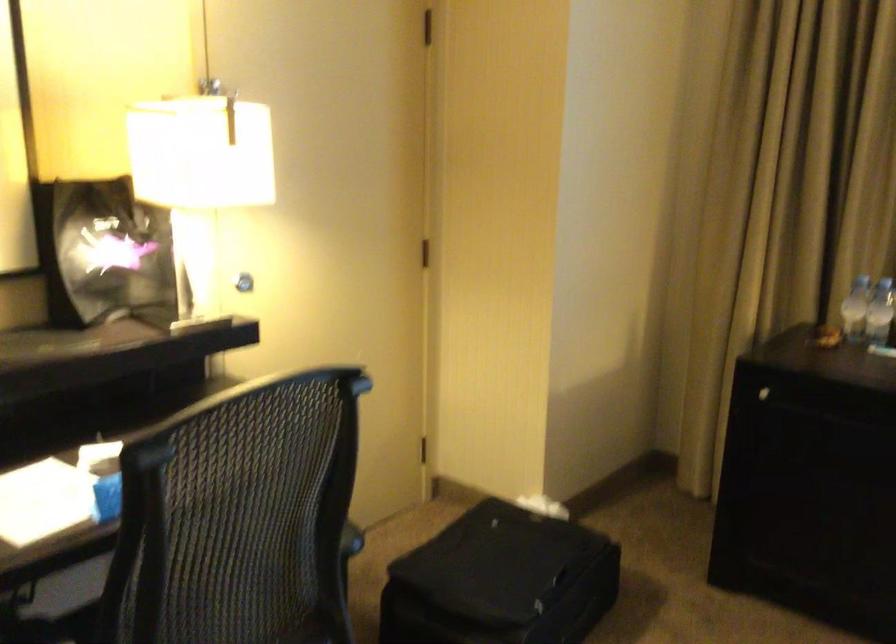
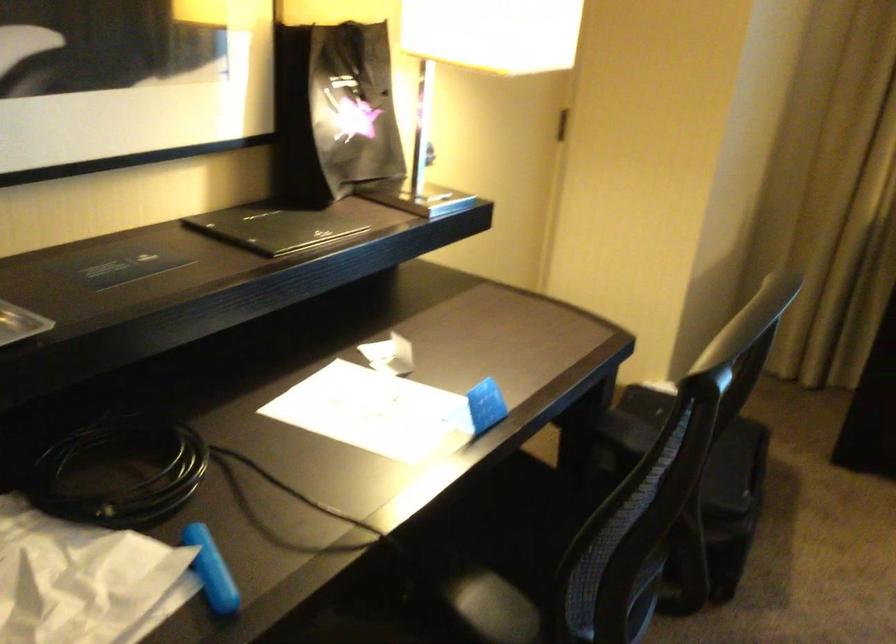
Find the pixel in the second image that matches (x=92, y=247) in the first image.

(334, 111)